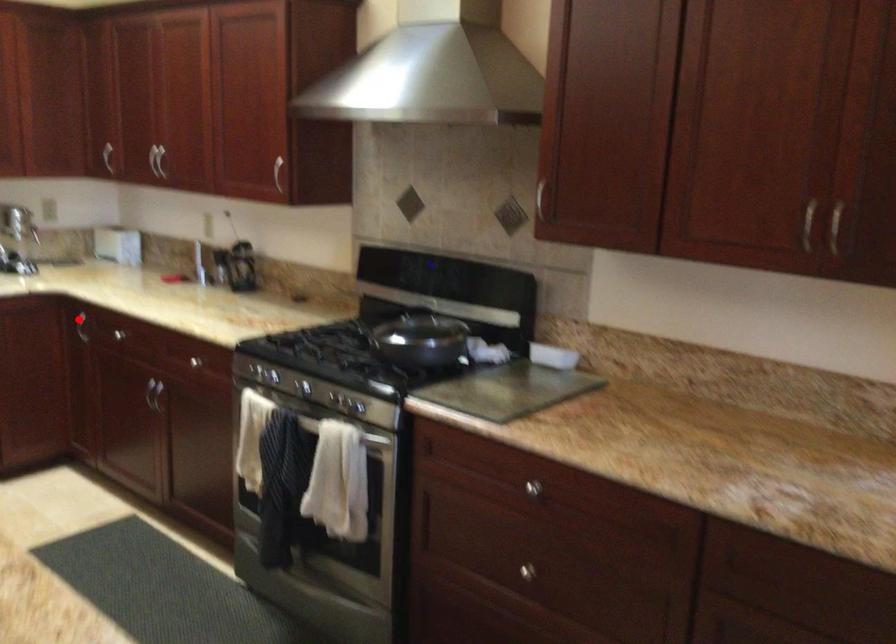
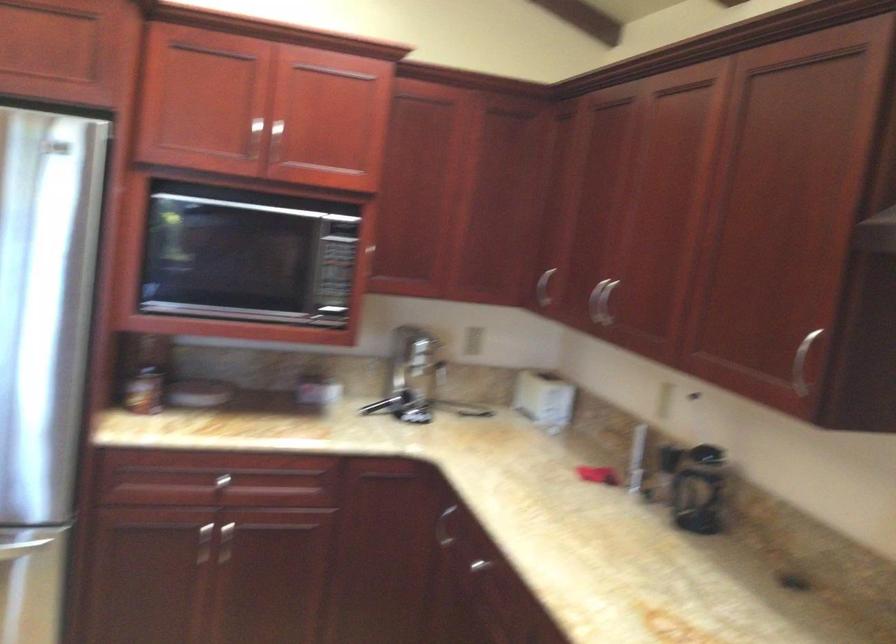
Question: I am providing you with two images of the same scene from different viewpoints. A red point is shown in image1. For the corresponding object point in image2, is it positioned nearer or farther from the camera?

Choices:
 (A) Nearer
 (B) Farther

Answer: (A)